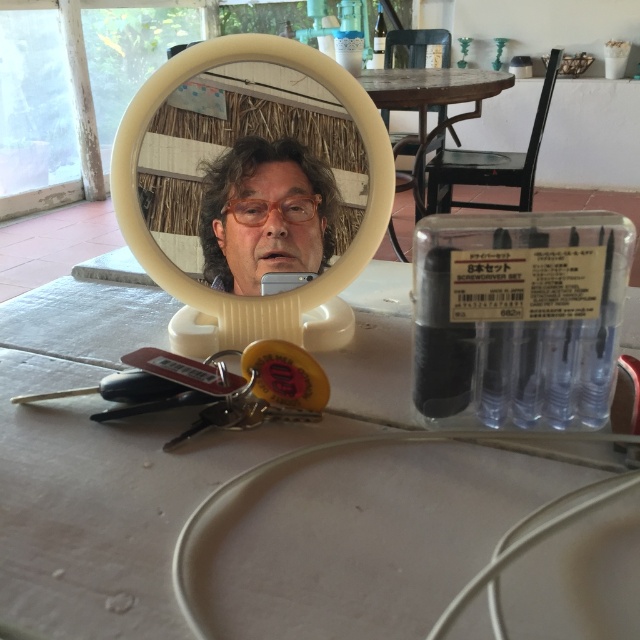
In the scene shown: Is white matte table at center positioned behind white plastic mirror at center?

No, white matte table at center is in front of white plastic mirror at center.

Does white matte table at center appear on the right side of white plastic mirror at center?

No, white matte table at center is not to the right of white plastic mirror at center.

Locate an element on the screen. The image size is (640, 640). white matte table at center is located at coordinates (132, 458).

Does white plastic mirror at center have a greater height compared to matte plastic man at center?

Correct, white plastic mirror at center is much taller as matte plastic man at center.

Can you confirm if white plastic mirror at center is positioned below matte plastic man at center?

Actually, white plastic mirror at center is above matte plastic man at center.

I want to click on white plastic mirror at center, so click(237, 294).

Is point (400, 348) positioned in front of point (225, 157)?

That is False.

Who is taller, white matte table at center or matte plastic man at center?

With more height is white matte table at center.

Is point (72, 438) positioned in front of point (296, 161)?

Yes, point (72, 438) is in front of point (296, 161).

At what (x,y) coordinates should I click in order to perform the action: click on white matte table at center. Please return your answer as a coordinate pair (x, y). The width and height of the screenshot is (640, 640). Looking at the image, I should click on (132, 458).